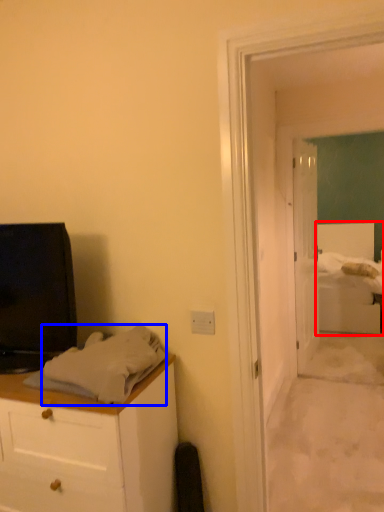
Question: Which of the following is the closest to the observer, bed (highlighted by a red box) or sheet (highlighted by a blue box)?

Choices:
 (A) bed
 (B) sheet

Answer: (B)